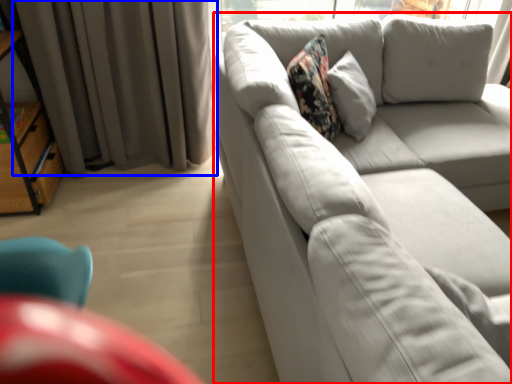
Question: Among these objects, which one is farthest to the camera, studio couch (highlighted by a red box) or curtain (highlighted by a blue box)?

Choices:
 (A) studio couch
 (B) curtain

Answer: (B)